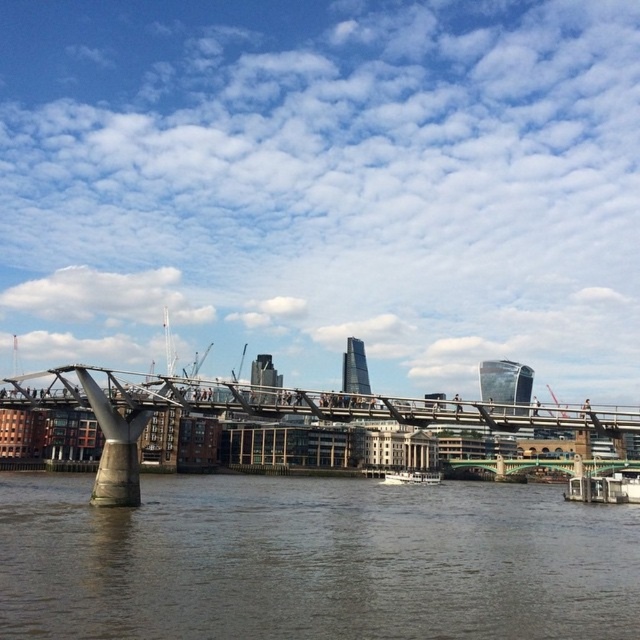
Can you confirm if metallic gray bridge at center is bigger than white wooden boat at lower center?

Correct, metallic gray bridge at center is larger in size than white wooden boat at lower center.

Does metallic gray bridge at center appear on the left side of white wooden boat at lower center?

In fact, metallic gray bridge at center is to the right of white wooden boat at lower center.

Which is behind, point (467, 404) or point (406, 477)?

The point (406, 477) is more distant.

You are a GUI agent. You are given a task and a screenshot of the screen. Output one action in this format:
    pyautogui.click(x=<x>, y=<y>)
    Task: Click on the metallic gray bridge at center
    
    Given the screenshot: What is the action you would take?
    pyautogui.click(x=257, y=412)

Can you confirm if brown concrete water at lower center is taller than white wooden boat at lower center?

Indeed, brown concrete water at lower center has a greater height compared to white wooden boat at lower center.

Between brown concrete water at lower center and white wooden boat at lower center, which one is positioned higher?

brown concrete water at lower center is above.

In order to click on brown concrete water at lower center in this screenshot , I will do `click(314, 561)`.

At what (x,y) coordinates should I click in order to perform the action: click on brown concrete water at lower center. Please return your answer as a coordinate pair (x, y). Looking at the image, I should click on (314, 561).

Is brown concrete water at lower center wider than metallic gray bridge at center?

In fact, brown concrete water at lower center might be narrower than metallic gray bridge at center.

Between brown concrete water at lower center and metallic gray bridge at center, which one appears on the right side from the viewer's perspective?

Positioned to the right is metallic gray bridge at center.

Which is in front, point (198, 512) or point (545, 410)?

Positioned in front is point (545, 410).

The width and height of the screenshot is (640, 640). In order to click on brown concrete water at lower center in this screenshot , I will do `click(314, 561)`.